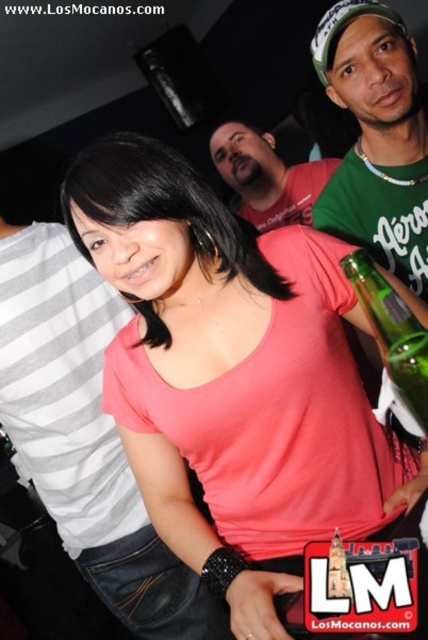
From the picture: You are at a party and want to take a photo of the pink matte shirt at center and the green glass bottle at right. Which object is wider when captured in the photo?

The pink matte shirt at center is wider than the green glass bottle at right.

You are at a party and want to take a photo of the pink matte shirt at center and the green matte shirt at upper right. Which one should you zoom in on to capture more details?

The pink matte shirt at center is bigger than the green matte shirt at upper right, so you should zoom in on the pink matte shirt at center to capture more details.

You are at a party and want to hand a green glass bottle at right to the person wearing the pink matte shirt at center. Can you reach them without moving from your current position?

The pink matte shirt at center is located below the green glass bottle at right, so you can reach the person wearing the pink matte shirt at center by extending your arm downward from the green glass bottle at right.